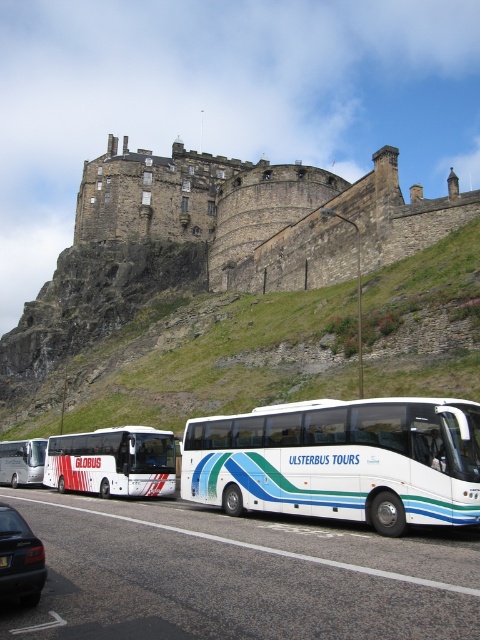
You are a tour guide standing near the road. You want to show tourists the brown stone castle at upper center. Which direction should you point to so that it is above the white glossy bus at lower left in their view?

The brown stone castle at upper center is positioned over the white glossy bus at lower left, so you should point upwards from the white glossy bus at lower left to show the castle above it.

You are a photographer standing at the base of the castle hill. You want to capture a photo that includes both the historic castle and the shiny black sedan at lower left without the white glossy bus at left blocking the view. Is this possible based on their positions?

The shiny black sedan at lower left is located above the white glossy bus at left, so if you position yourself lower or adjust your angle to look upwards, you can include both the castle and the sedan while avoiding the white glossy bus at left blocking the view.

You are a tourist standing at the base of the castle hill and see both the shiny black sedan at lower left and the white glossy bus at left. Which vehicle is closer to the castle?

The shiny black sedan at lower left is positioned on the right side of the white glossy bus at left, so the white glossy bus at left is closer to the castle since it is in front of the sedan.